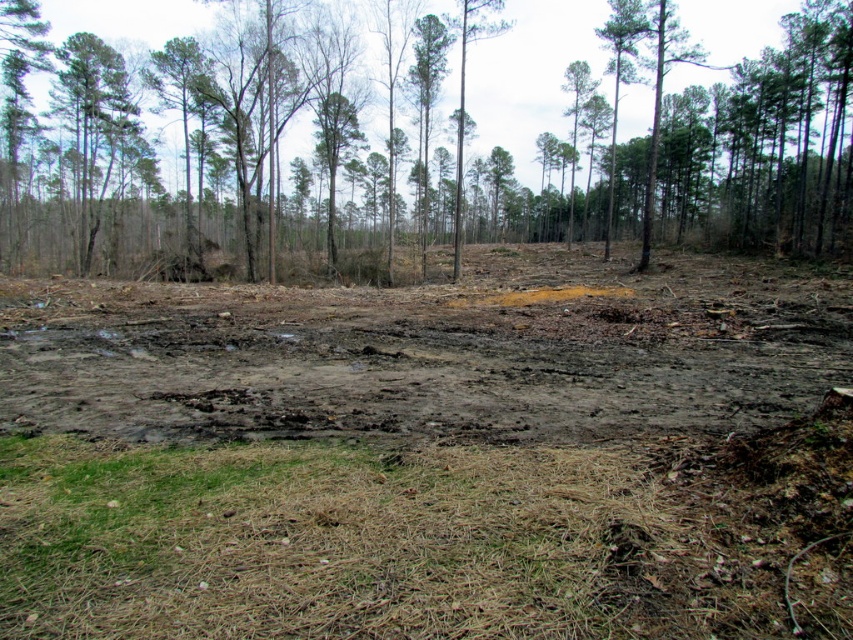
Question: Does brown muddy field at center appear under green leafy tree at upper center?

Choices:
 (A) no
 (B) yes

Answer: (B)

Question: Which point appears farthest from the camera in this image?

Choices:
 (A) (461, 49)
 (B) (596, 305)

Answer: (A)

Question: Can you confirm if brown muddy field at center is bigger than green leafy tree at upper center?

Choices:
 (A) yes
 (B) no

Answer: (B)

Question: Can you confirm if brown muddy field at center is wider than green leafy tree at upper center?

Choices:
 (A) yes
 (B) no

Answer: (B)

Question: Which point is closer to the camera?

Choices:
 (A) (437, 20)
 (B) (444, 292)

Answer: (B)

Question: Among these points, which one is farthest from the camera?

Choices:
 (A) (125, 632)
 (B) (194, 104)

Answer: (B)